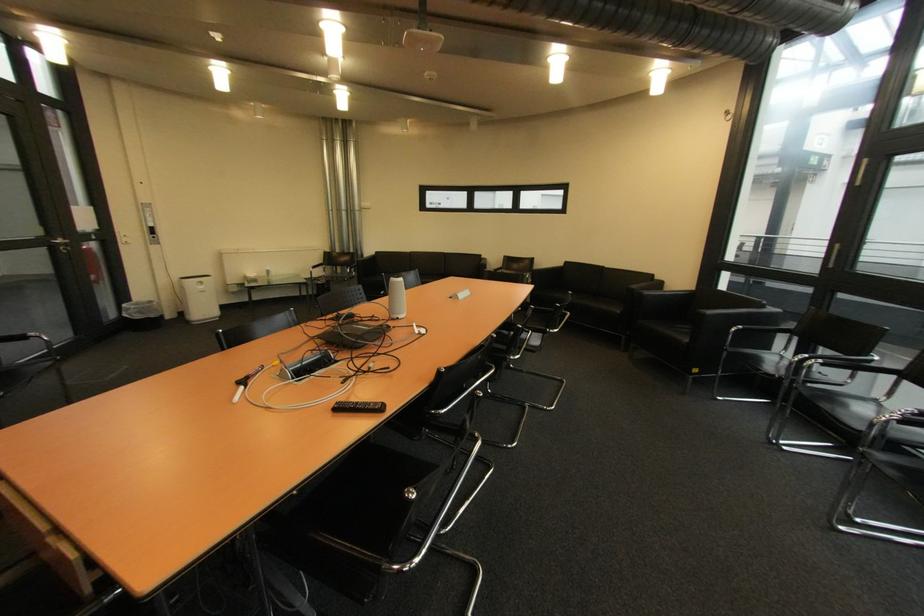
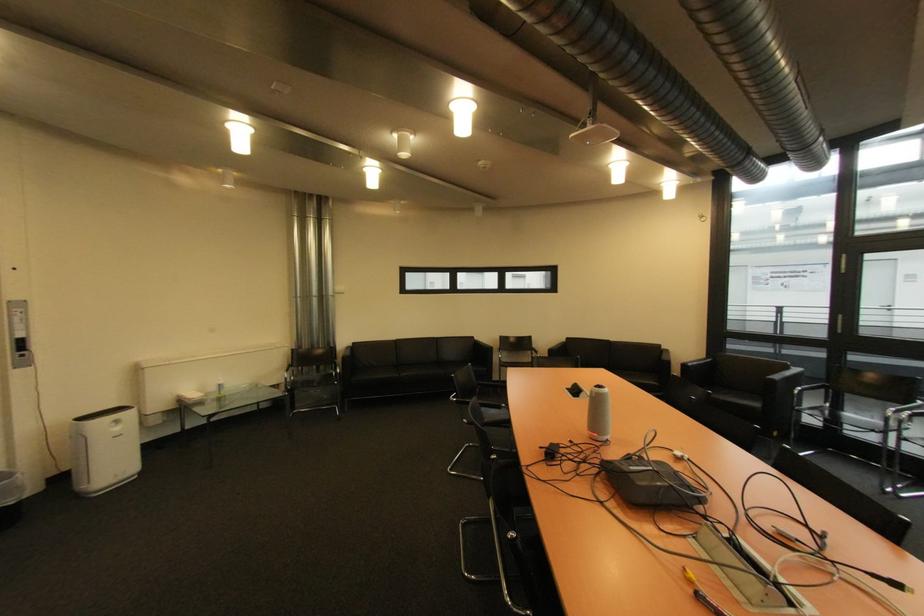
Find the pixel in the second image that matches point (274, 275) in the first image.

(223, 391)